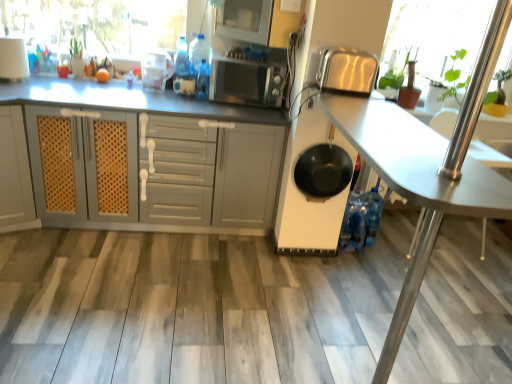
At what (x,y) coordinates should I click in order to perform the action: click on vacant space to the left of transparent plastic container at upper center, which is the second appliance from right to left. Please return your answer as a coordinate pair (x, y). This screenshot has width=512, height=384. Looking at the image, I should click on click(117, 90).